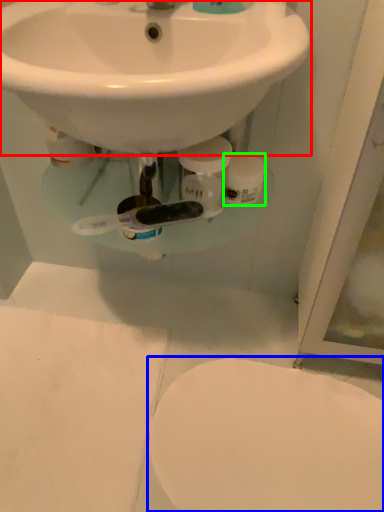
Question: Estimate the real-world distances between objects in this image. Which object is closer to sink (highlighted by a red box), toilet (highlighted by a blue box) or toilet paper (highlighted by a green box)?

Choices:
 (A) toilet
 (B) toilet paper

Answer: (B)